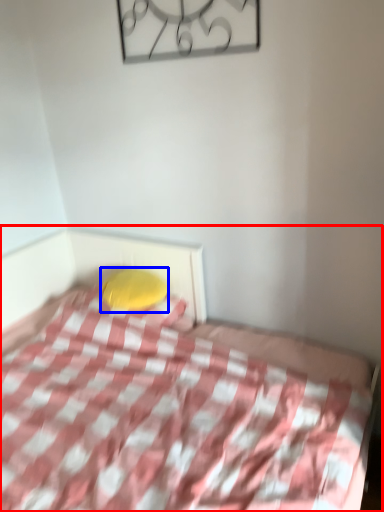
Question: Among these objects, which one is farthest to the camera, bed (highlighted by a red box) or pillow (highlighted by a blue box)?

Choices:
 (A) bed
 (B) pillow

Answer: (B)